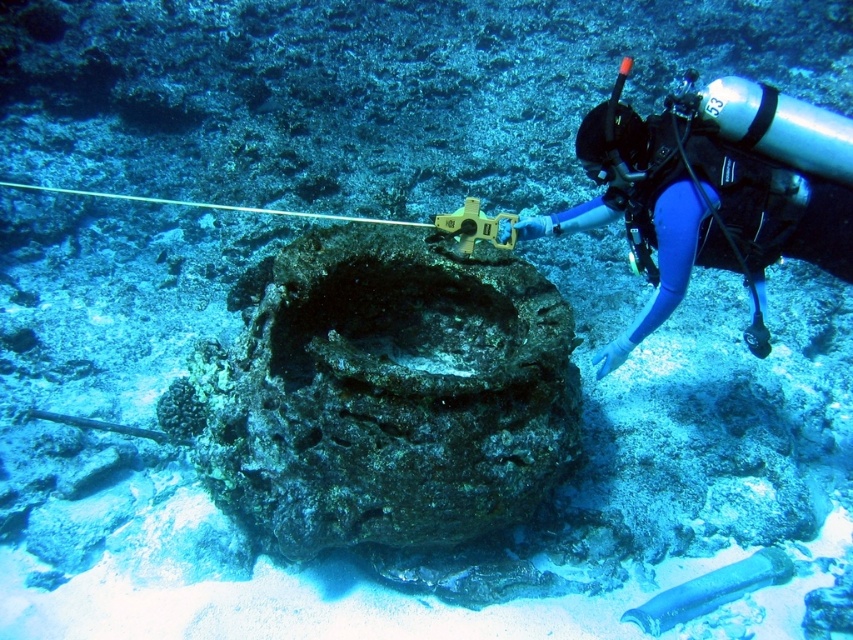
Does point (695, 166) come behind point (747, 573)?

No, it is not.

Who is positioned more to the right, blue neoprene wetsuit at center or translucent blue glass pipe at lower center?

From the viewer's perspective, translucent blue glass pipe at lower center appears more on the right side.

The width and height of the screenshot is (853, 640). I want to click on blue neoprene wetsuit at center, so click(x=714, y=188).

Does point (329, 356) lie in front of point (692, 604)?

Yes, it is in front of point (692, 604).

Between point (311, 435) and point (682, 584), which one is positioned behind?

The point (682, 584) is behind.

Describe the element at coordinates (381, 394) in the screenshot. This screenshot has width=853, height=640. I see `rusty metallic rock at center` at that location.

At what (x,y) coordinates should I click in order to perform the action: click on rusty metallic rock at center. Please return your answer as a coordinate pair (x, y). The width and height of the screenshot is (853, 640). Looking at the image, I should click on (381, 394).

Is rusty metallic rock at center below blue neoprene wetsuit at center?

Correct, rusty metallic rock at center is located below blue neoprene wetsuit at center.

Who is taller, rusty metallic rock at center or blue neoprene wetsuit at center?

With more height is rusty metallic rock at center.

Where is `rusty metallic rock at center`? This screenshot has width=853, height=640. rusty metallic rock at center is located at coordinates coord(381,394).